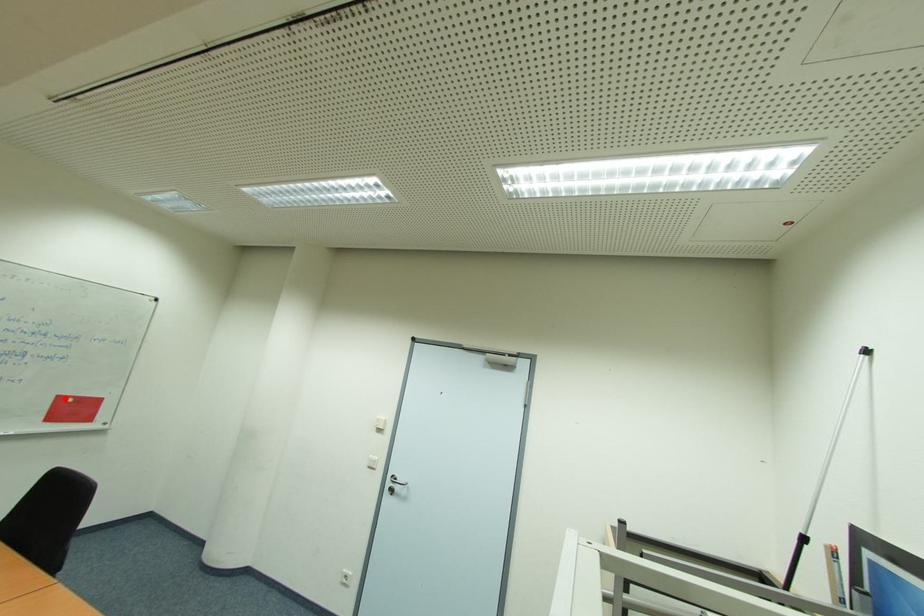
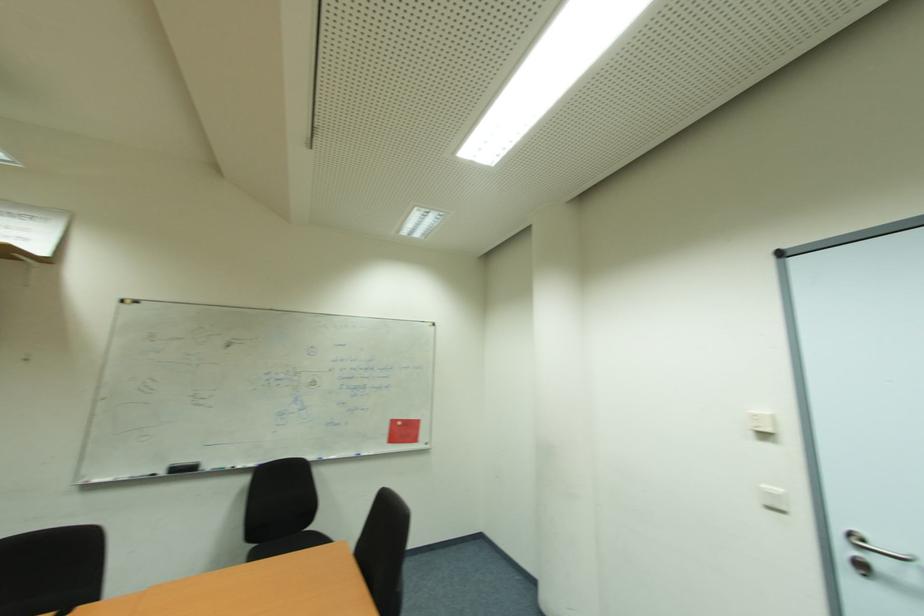
Find the pixel in the second image that matches the highlighted location in the first image.

(397, 423)